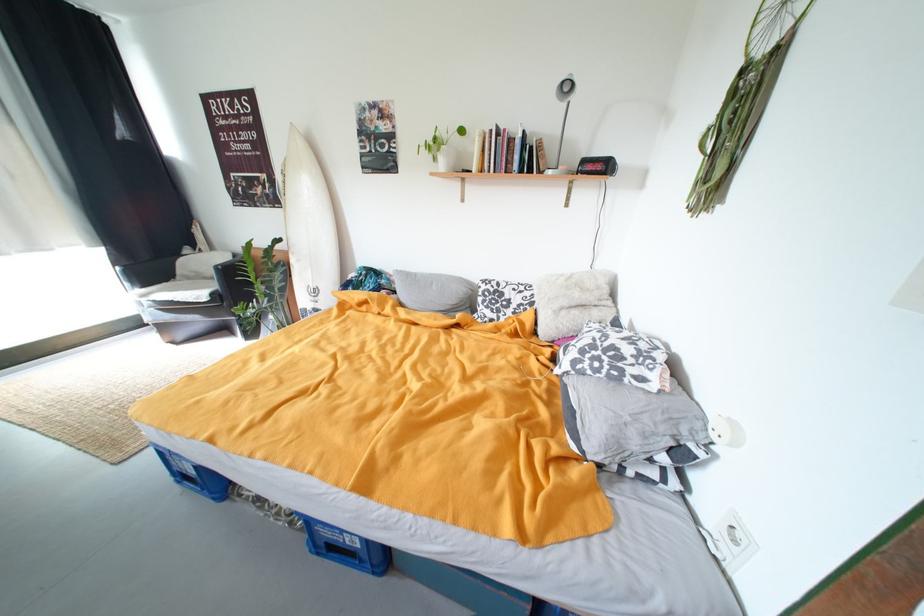
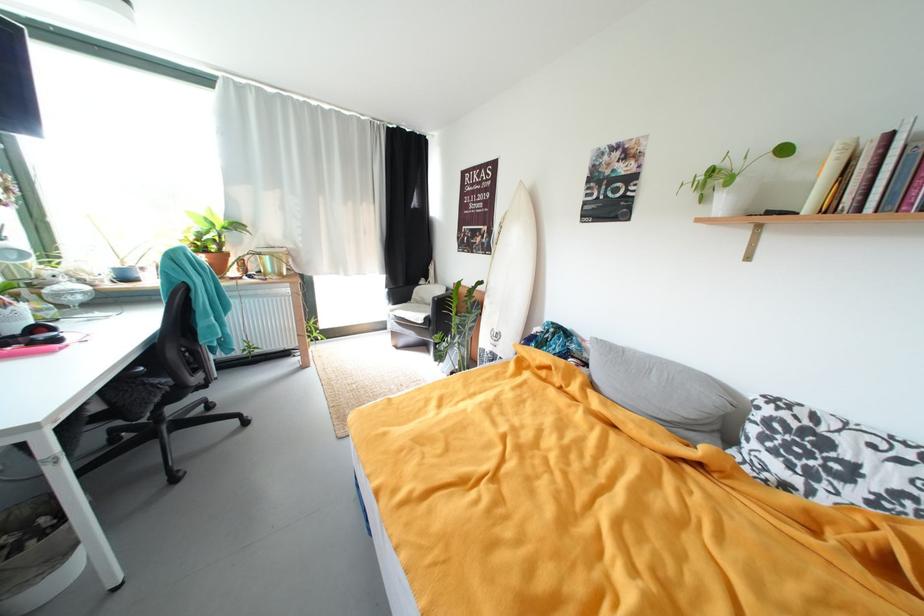
Find the pixel in the second image that matches (396,282) in the first image.

(588, 347)